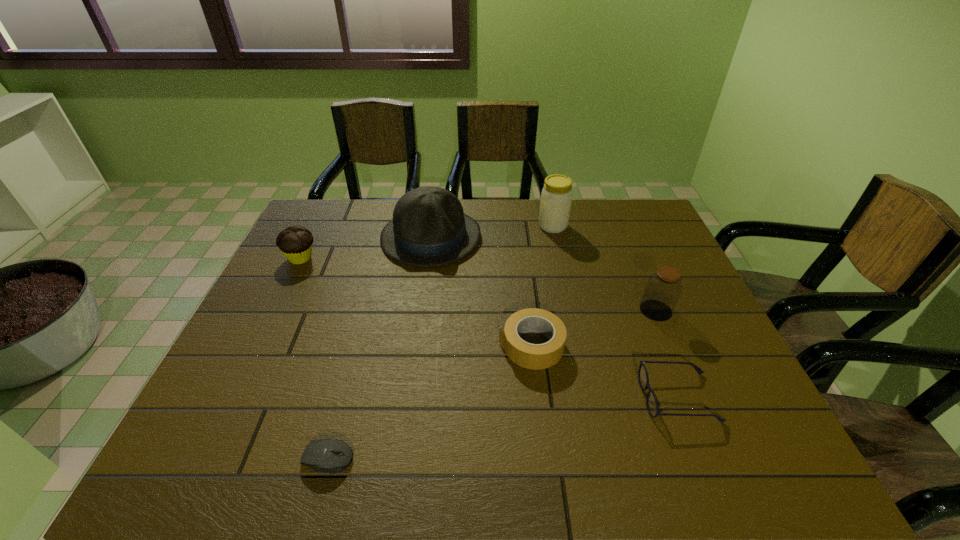
This screenshot has width=960, height=540. Find the location of `the shortest object`. the shortest object is located at coordinates (318, 455).

This screenshot has width=960, height=540. I want to click on vacant space located on the front of the farther jar, so click(x=564, y=277).

At what (x,y) coordinates should I click in order to perform the action: click on free location located on the front-facing side of the bowler hat. Please return your answer as a coordinate pair (x, y). Looking at the image, I should click on (424, 281).

Locate an element on the screen. vacant area located on the left of the fourth nearest object is located at coordinates (610, 310).

Locate an element on the screen. free location located 0.210m on the back of the leftmost object is located at coordinates (324, 211).

Locate an element on the screen. The height and width of the screenshot is (540, 960). vacant position located at the edge of the third nearest object is located at coordinates (385, 346).

I want to click on vacant area situated 0.120m at the edge of the third nearest object, so click(x=450, y=346).

The image size is (960, 540). I want to click on free space located 0.150m at the edge of the third nearest object, so click(x=438, y=346).

The height and width of the screenshot is (540, 960). I want to click on free spot located 0.130m on the front-facing side of the spectacles, so (584, 397).

Locate an element on the screen. This screenshot has width=960, height=540. free point located 0.110m on the front-facing side of the spectacles is located at coordinates click(593, 397).